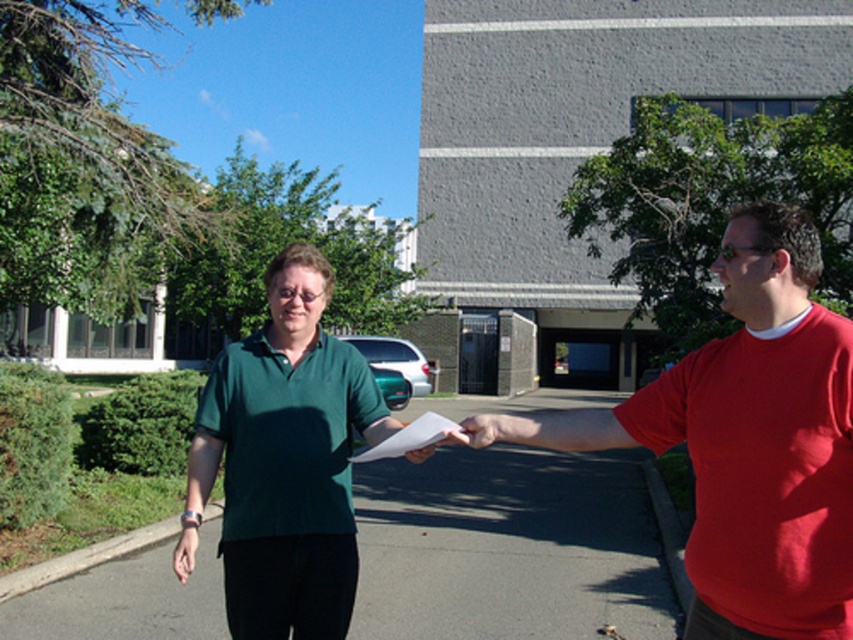
From the picture: Is red matte shirt at right above green matte shirt at center?

Correct, red matte shirt at right is located above green matte shirt at center.

At what (x,y) coordinates should I click in order to perform the action: click on red matte shirt at right. Please return your answer as a coordinate pair (x, y). This screenshot has width=853, height=640. Looking at the image, I should click on (751, 440).

Describe the element at coordinates (751, 440) in the screenshot. The width and height of the screenshot is (853, 640). I see `red matte shirt at right` at that location.

Locate an element on the screen. This screenshot has height=640, width=853. red matte shirt at right is located at coordinates (751, 440).

Who is shorter, green matte shirt at center or matte white paper at center?

matte white paper at center

Between green matte shirt at center and matte white paper at center, which one appears on the left side from the viewer's perspective?

Positioned to the left is green matte shirt at center.

This screenshot has width=853, height=640. What do you see at coordinates (283, 461) in the screenshot?
I see `green matte shirt at center` at bounding box center [283, 461].

Image resolution: width=853 pixels, height=640 pixels. What are the coordinates of `green matte shirt at center` in the screenshot? It's located at 283,461.

Between point (751, 582) and point (468, 417), which one is positioned behind?

The point (468, 417) is more distant.

Between point (579, 449) and point (444, 444), which one is positioned in front?

Point (579, 449) is in front.

Who is more forward, (x=772, y=426) or (x=474, y=429)?

Point (x=772, y=426) is in front.

Identify the location of red matte shirt at right. (751, 440).